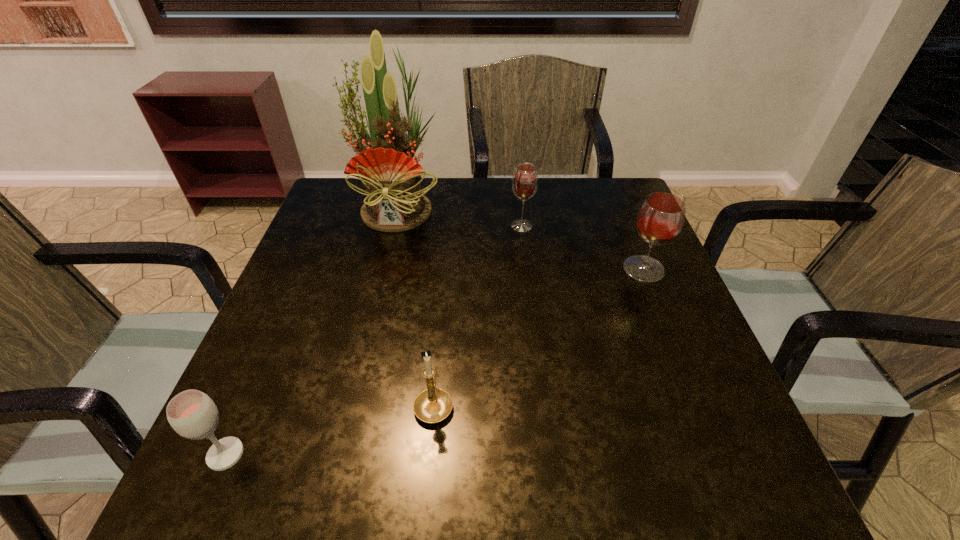
I want to click on vacant space that is in between the third farthest object and the second wineglass from right to left, so click(x=583, y=248).

Identify the location of free spot between the candle holder and the leftmost wineglass. Image resolution: width=960 pixels, height=540 pixels. (329, 429).

The image size is (960, 540). I want to click on vacant region between the tallest object and the farthest wineglass, so click(x=461, y=217).

You are a GUI agent. You are given a task and a screenshot of the screen. Output one action in this format:
    pyautogui.click(x=<x>, y=<y>)
    Task: Click on the free space between the nearest object and the second wineglass from left to right
    Image resolution: width=960 pixels, height=540 pixels.
    Given the screenshot: What is the action you would take?
    pyautogui.click(x=373, y=340)

The height and width of the screenshot is (540, 960). What are the coordinates of `vacant point located between the rightmost object and the second wineglass from left to right` in the screenshot? It's located at (583, 248).

This screenshot has height=540, width=960. What are the coordinates of `vacant space that is in between the rightmost wineglass and the nearest wineglass` in the screenshot? It's located at (435, 362).

The width and height of the screenshot is (960, 540). I want to click on vacant region between the second nearest wineglass and the nearest object, so click(x=435, y=362).

Locate an element on the screen. free space that is in between the fourth farthest object and the farthest wineglass is located at coordinates (478, 315).

Find the location of a particular element. This screenshot has height=540, width=960. empty location between the fourth farthest object and the tallest object is located at coordinates (417, 305).

You are a GUI agent. You are given a task and a screenshot of the screen. Output one action in this format:
    pyautogui.click(x=<x>, y=<y>)
    Task: Click on the object that stands as the third closest to the nearest object
    This screenshot has width=960, height=540.
    Given the screenshot: What is the action you would take?
    pyautogui.click(x=525, y=181)